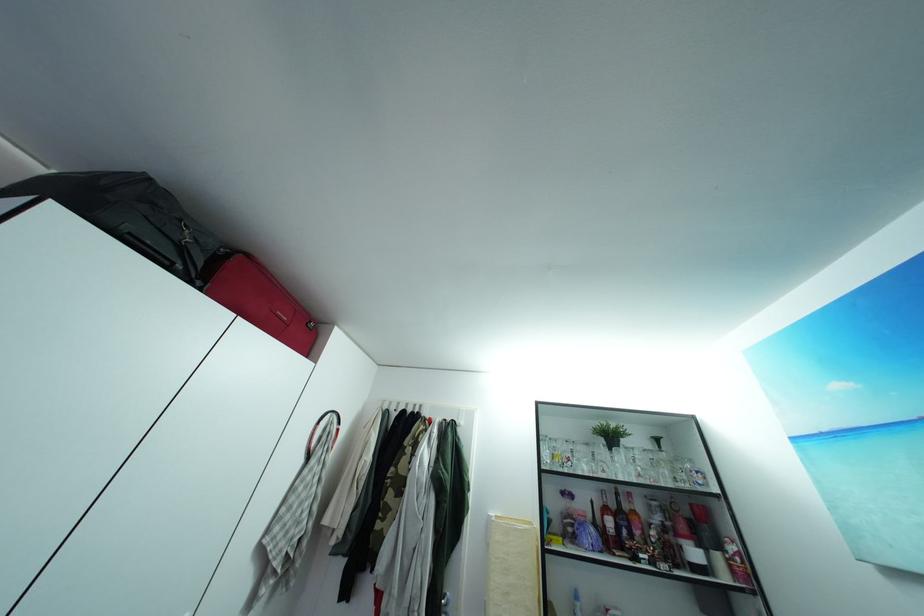
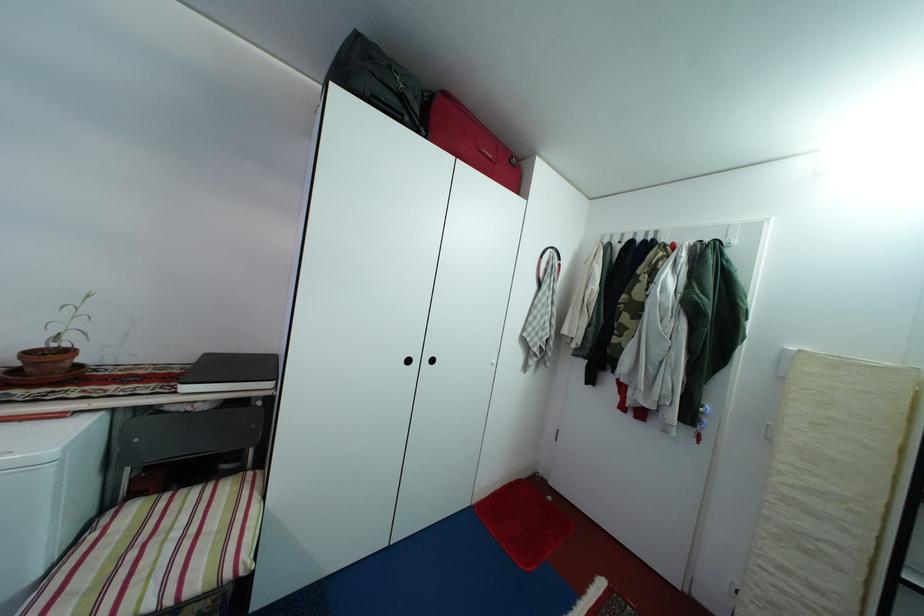
The point at (258,264) is marked in the first image. Where is the corresponding point in the second image?

(454, 100)